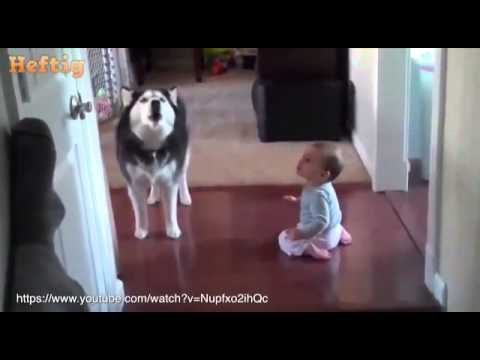
Image resolution: width=480 pixels, height=360 pixels. Identify the location of carpet. (219, 128).